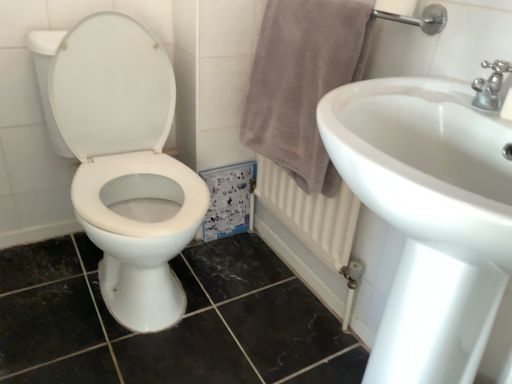
Question: Does silver metallic faucet at upper right touch light gray plush towel at right?

Choices:
 (A) yes
 (B) no

Answer: (B)

Question: Can you confirm if silver metallic faucet at upper right is smaller than light gray plush towel at right?

Choices:
 (A) yes
 (B) no

Answer: (A)

Question: Is silver metallic faucet at upper right positioned behind light gray plush towel at right?

Choices:
 (A) no
 (B) yes

Answer: (A)

Question: Can you confirm if silver metallic faucet at upper right is thinner than light gray plush towel at right?

Choices:
 (A) yes
 (B) no

Answer: (A)

Question: From the image's perspective, does silver metallic faucet at upper right appear lower than light gray plush towel at right?

Choices:
 (A) no
 (B) yes

Answer: (B)

Question: Considering their positions, is white glossy toilet at left located in front of or behind silver metallic faucet at upper right?

Choices:
 (A) front
 (B) behind

Answer: (B)

Question: From a real-world perspective, is white glossy toilet at left positioned above or below silver metallic faucet at upper right?

Choices:
 (A) above
 (B) below

Answer: (B)

Question: In the image, is white glossy toilet at left on the left side or the right side of silver metallic faucet at upper right?

Choices:
 (A) right
 (B) left

Answer: (B)

Question: Considering the positions of white glossy toilet at left and silver metallic faucet at upper right in the image, is white glossy toilet at left taller or shorter than silver metallic faucet at upper right?

Choices:
 (A) tall
 (B) short

Answer: (A)

Question: Looking at their shapes, would you say silver metallic faucet at upper right is wider or thinner than light gray plush towel at right?

Choices:
 (A) thin
 (B) wide

Answer: (A)

Question: Is silver metallic faucet at upper right spatially inside light gray plush towel at right, or outside of it?

Choices:
 (A) inside
 (B) outside

Answer: (B)

Question: Considering the positions of silver metallic faucet at upper right and light gray plush towel at right in the image, is silver metallic faucet at upper right bigger or smaller than light gray plush towel at right?

Choices:
 (A) big
 (B) small

Answer: (B)

Question: From a real-world perspective, is silver metallic faucet at upper right physically located above or below light gray plush towel at right?

Choices:
 (A) above
 (B) below

Answer: (A)

Question: In the image, is light gray plush towel at right on the left side or the right side of silver metallic faucet at upper right?

Choices:
 (A) left
 (B) right

Answer: (A)

Question: Choose the correct answer: Is light gray plush towel at right inside silver metallic faucet at upper right or outside it?

Choices:
 (A) outside
 (B) inside

Answer: (A)